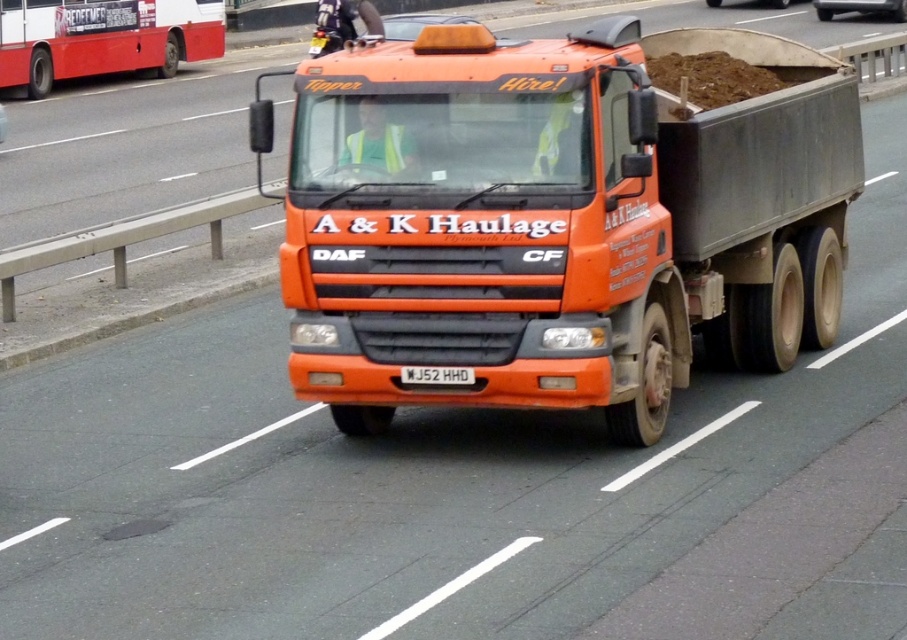
You are a driver approaching the orange matte truck at center in your car. You notice the white plastic license plate at center. Can you see the entire license plate clearly while driving past the truck?

The orange matte truck at center is larger in size than white plastic license plate at center, so yes, you can see the entire license plate clearly while driving past the truck.

You are a traffic officer observing the orange matte truck at center and the white plastic license plate at center. Is the truck correctly positioned according to traffic regulations?

The orange matte truck at center is positioned over the white plastic license plate at center, which violates traffic regulations as vehicles must not obstruct license plates.

You are a pedestrian standing on the sidewalk next to the concrete barrier. You see two points on the road ahead of you, one at point [724,224] and the other at point [447,368]. Which point is closer to you?

Point [724,224] is further to the viewer than point [447,368], so the point closer to you is point [447,368].